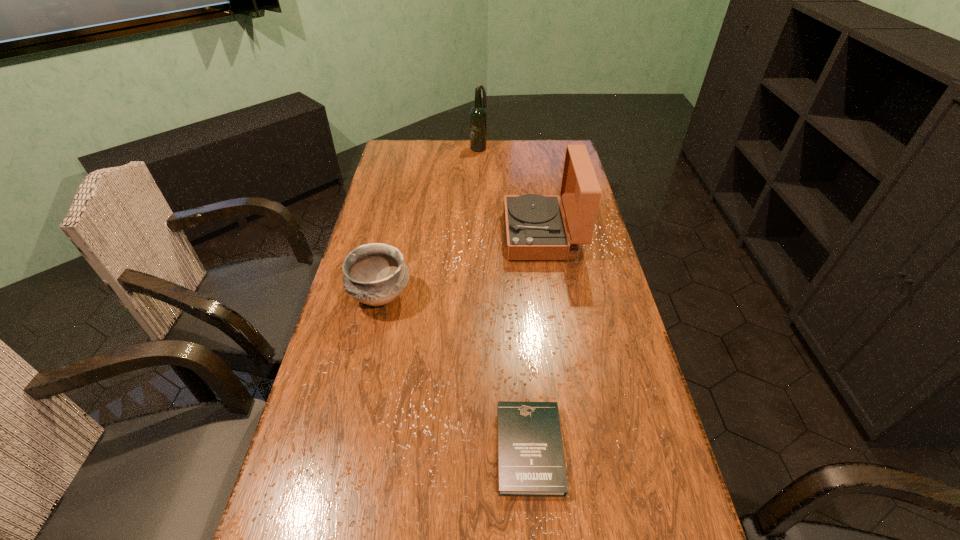
Identify the location of free space located 0.270m on the face of the second farthest object. This screenshot has height=540, width=960. (426, 235).

Where is `vacant region located 0.050m on the front of the leftmost object`? The image size is (960, 540). vacant region located 0.050m on the front of the leftmost object is located at coordinates (372, 335).

Find the location of a particular element. This screenshot has width=960, height=540. vacant point located on the left of the book is located at coordinates (475, 449).

Find the location of a particular element. This screenshot has height=540, width=960. object situated at the far edge is located at coordinates (478, 117).

Where is `object that is at the left edge`? Image resolution: width=960 pixels, height=540 pixels. object that is at the left edge is located at coordinates (375, 274).

Find the location of a particular element. object positioned at the right edge is located at coordinates (535, 229).

This screenshot has width=960, height=540. Identify the location of free space at the far edge of the desktop. (434, 150).

The image size is (960, 540). Find the location of `blank space at the left edge`. blank space at the left edge is located at coordinates click(383, 231).

Where is `vacant region at the right edge of the desktop`? Image resolution: width=960 pixels, height=540 pixels. vacant region at the right edge of the desktop is located at coordinates (601, 370).

At what (x,y) coordinates should I click in order to perform the action: click on free space at the far left corner. Please return your answer as a coordinate pair (x, y). Looking at the image, I should click on (405, 154).